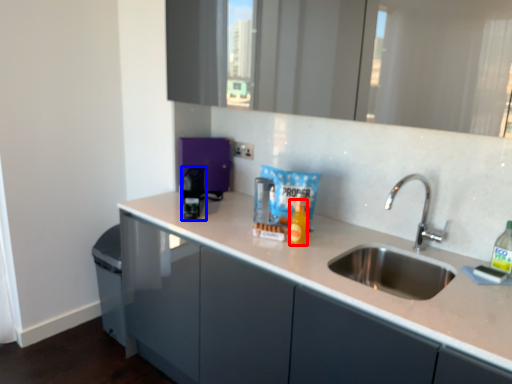
Question: Among these objects, which one is nearest to the camera, bottle (highlighted by a red box) or appliance (highlighted by a blue box)?

Choices:
 (A) bottle
 (B) appliance

Answer: (A)